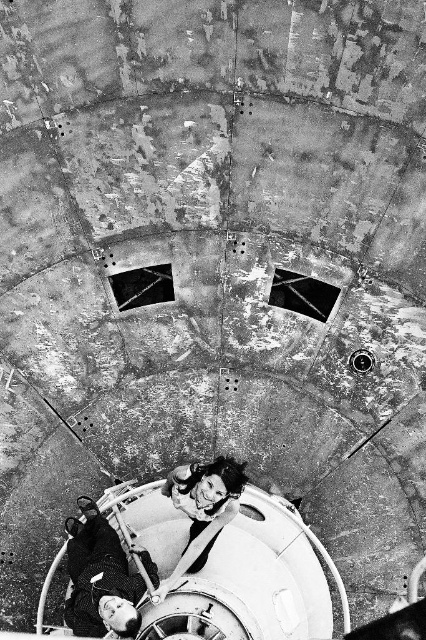
You are standing in the circular structure and want to pick up the smooth leather jacket at lower left and the smooth skin woman at center. Which object is easier to reach without moving your position?

The smooth leather jacket at lower left is closer to the viewer than the smooth skin woman at center, so it is easier to reach without moving your position.